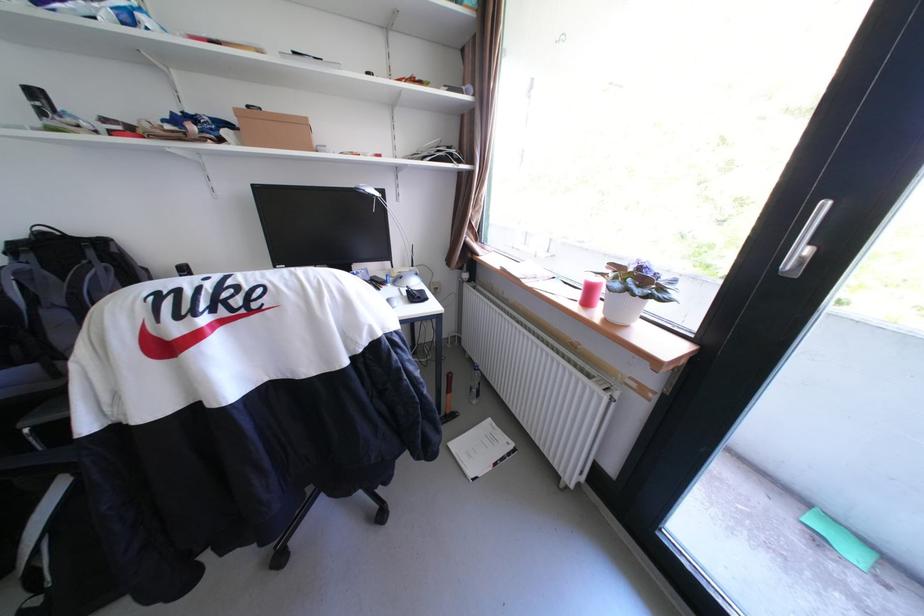
The image size is (924, 616). In order to click on computer mouse in this screenshot , I will do `click(416, 294)`.